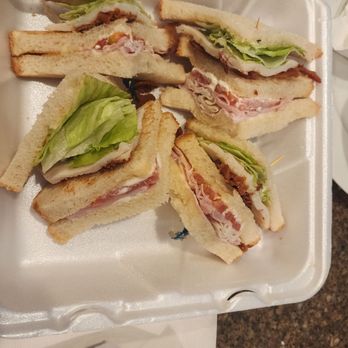
Where is `table`? The height and width of the screenshot is (348, 348). table is located at coordinates (329, 320).